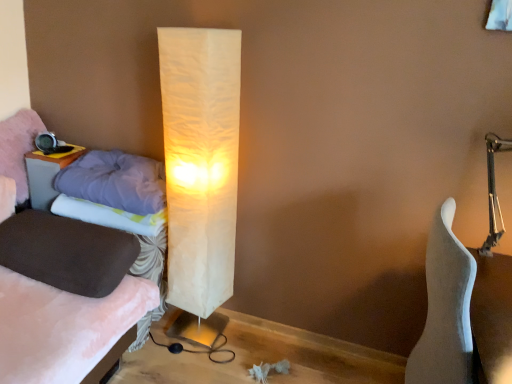
Question: Based on their positions, is velvet purple pillow at left, the 1th pillow viewed from the top, located to the left or right of matte wood table at left?

Choices:
 (A) left
 (B) right

Answer: (A)

Question: Considering the positions of velvet purple pillow at left, the 1th pillow viewed from the top, and matte wood table at left in the image, is velvet purple pillow at left, the 1th pillow viewed from the top, wider or thinner than matte wood table at left?

Choices:
 (A) thin
 (B) wide

Answer: (B)

Question: Which of these objects is positioned closest to the matte wood table at left?

Choices:
 (A) velvet purple pillow at left, the 1th pillow viewed from the top
 (B) white paper lamp at center
 (C) velvet brown bed at left
 (D) white matte guitar at right
 (E) white fabric pillow at left, which is the 2th pillow from bottom to top

Answer: (A)

Question: Which of these objects is positioned farthest from the white fabric pillow at left, which is the 2th pillow from bottom to top?

Choices:
 (A) suede-like brown pillow at left, which appears as the 1th pillow when ordered from the bottom
 (B) matte wood table at left
 (C) white matte guitar at right
 (D) white paper lamp at center
 (E) fluffy purple pillow at left, which is the 3th pillow in bottom-to-top order

Answer: (C)